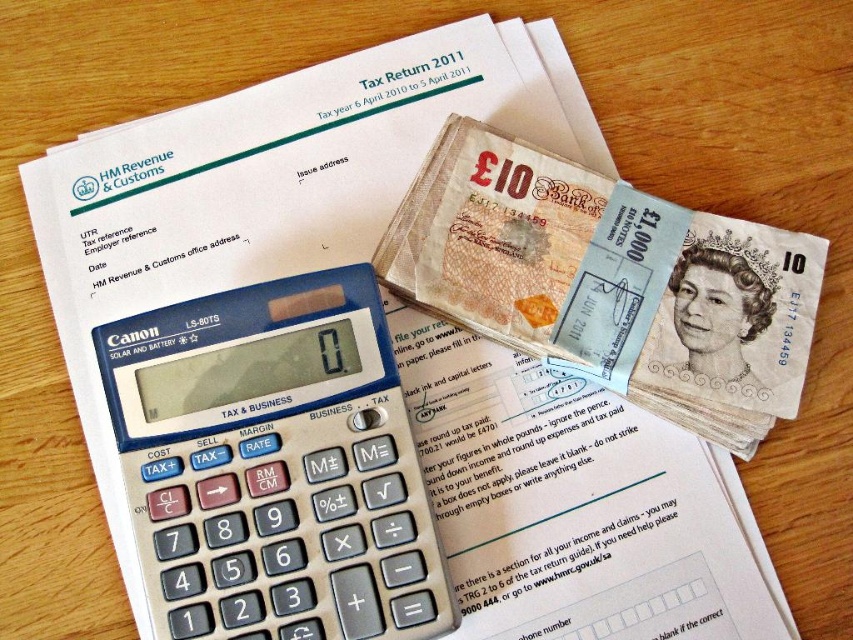
Who is positioned more to the left, silver metallic calculator at center or smooth paper £10 note at center?

From the viewer's perspective, silver metallic calculator at center appears more on the left side.

Which is more to the right, silver metallic calculator at center or smooth paper £10 note at center?

smooth paper £10 note at center

The height and width of the screenshot is (640, 853). What do you see at coordinates (274, 465) in the screenshot? I see `silver metallic calculator at center` at bounding box center [274, 465].

Where is `silver metallic calculator at center`? silver metallic calculator at center is located at coordinates (274, 465).